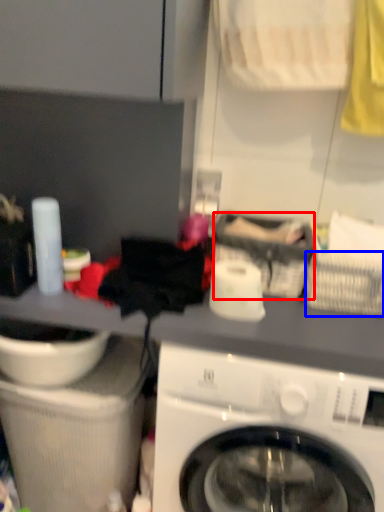
Question: Among these objects, which one is farthest to the camera, basket (highlighted by a red box) or basket (highlighted by a blue box)?

Choices:
 (A) basket
 (B) basket

Answer: (A)